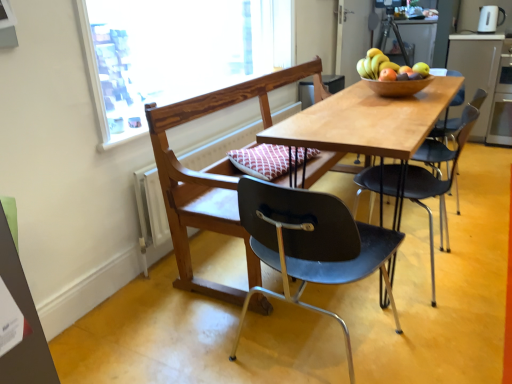
Locate an element on the screen. This screenshot has width=512, height=384. vacant space in matte black chair at center, positioned as the third chair in back-to-front order (from a real-world perspective) is located at coordinates (312, 343).